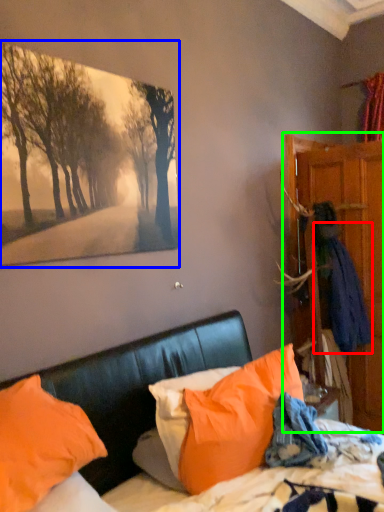
Question: Which object is the farthest from clothing (highlighted by a red box)? Choose among these: picture frame (highlighted by a blue box) or dresser (highlighted by a green box).

Choices:
 (A) picture frame
 (B) dresser

Answer: (A)